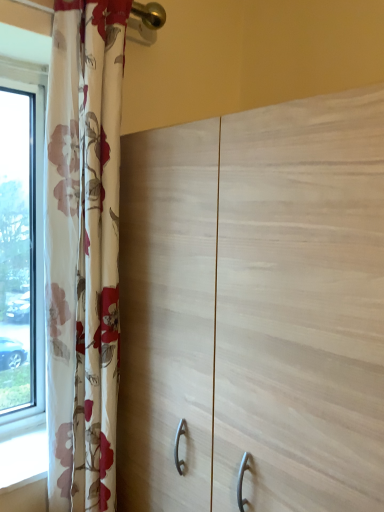
Question: Is light wood cupboard at center spatially inside floral fabric curtain at left, or outside of it?

Choices:
 (A) outside
 (B) inside

Answer: (A)

Question: Relative to floral fabric curtain at left, is light wood cupboard at center in front or behind?

Choices:
 (A) behind
 (B) front

Answer: (B)

Question: From a real-world perspective, is light wood cupboard at center physically located above or below floral fabric curtain at left?

Choices:
 (A) below
 (B) above

Answer: (A)

Question: From the image's perspective, relative to light wood cupboard at center, is floral fabric curtain at left above or below?

Choices:
 (A) below
 (B) above

Answer: (B)

Question: Is floral fabric curtain at left in front of or behind light wood cupboard at center in the image?

Choices:
 (A) behind
 (B) front

Answer: (A)

Question: Is floral fabric curtain at left to the left or to the right of light wood cupboard at center in the image?

Choices:
 (A) right
 (B) left

Answer: (B)

Question: Is floral fabric curtain at left situated inside light wood cupboard at center or outside?

Choices:
 (A) inside
 (B) outside

Answer: (B)